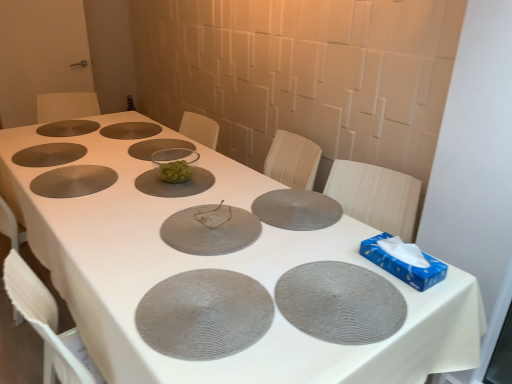
Locate an element on the screen. vacant space behind gray textured placemat at lower right, arranged as the ninth glass plate when viewed from the back is located at coordinates (307, 235).